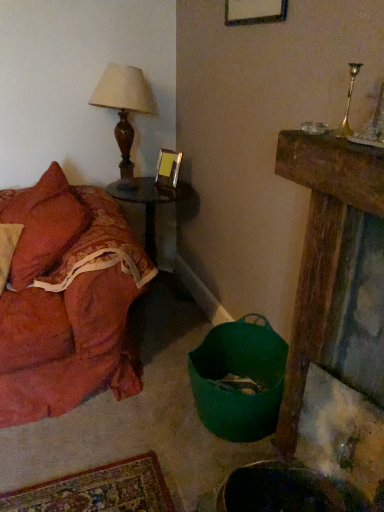
Question: From a real-world perspective, is matte brown wood table lamp at upper left located beneath wooden side table at center?

Choices:
 (A) no
 (B) yes

Answer: (A)

Question: Is matte brown wood table lamp at upper left in front of wooden side table at center?

Choices:
 (A) no
 (B) yes

Answer: (B)

Question: Is matte brown wood table lamp at upper left with wooden side table at center?

Choices:
 (A) yes
 (B) no

Answer: (B)

Question: From the image's perspective, does matte brown wood table lamp at upper left appear lower than wooden side table at center?

Choices:
 (A) yes
 (B) no

Answer: (B)

Question: Does matte brown wood table lamp at upper left have a lesser width compared to wooden side table at center?

Choices:
 (A) yes
 (B) no

Answer: (A)

Question: Is matte brown wood table lamp at upper left outside wooden side table at center?

Choices:
 (A) yes
 (B) no

Answer: (A)

Question: Can you confirm if matte brown wood table lamp at upper left is shorter than velvet orange couch at left?

Choices:
 (A) no
 (B) yes

Answer: (B)

Question: Is matte brown wood table lamp at upper left closer to camera compared to velvet orange couch at left?

Choices:
 (A) yes
 (B) no

Answer: (B)

Question: From a real-world perspective, is matte brown wood table lamp at upper left under velvet orange couch at left?

Choices:
 (A) yes
 (B) no

Answer: (B)

Question: From the image's perspective, would you say matte brown wood table lamp at upper left is positioned over velvet orange couch at left?

Choices:
 (A) yes
 (B) no

Answer: (A)

Question: Are matte brown wood table lamp at upper left and velvet orange couch at left far apart?

Choices:
 (A) no
 (B) yes

Answer: (A)

Question: Is matte brown wood table lamp at upper left facing towards velvet orange couch at left?

Choices:
 (A) yes
 (B) no

Answer: (B)

Question: Can you confirm if metallic gold picture frame at upper center is thinner than wooden side table at center?

Choices:
 (A) yes
 (B) no

Answer: (A)